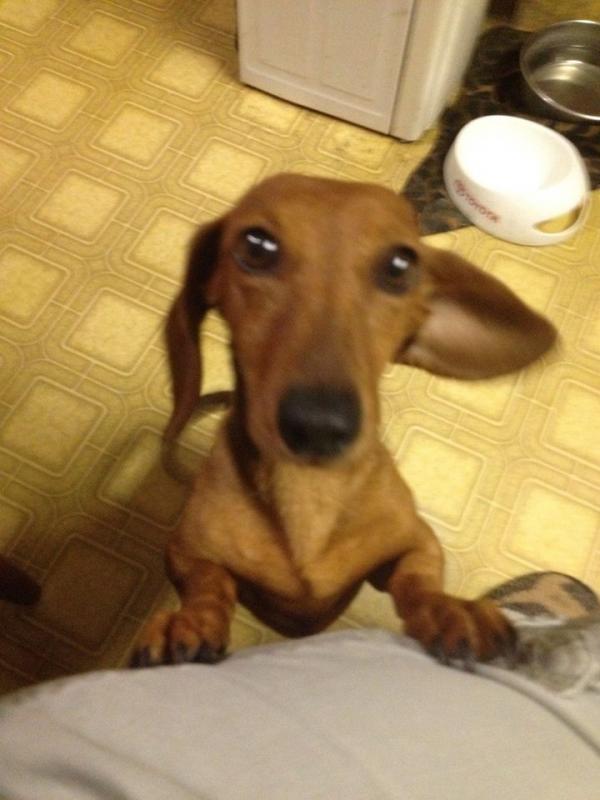
At what (x,y) coordinates should I click in order to perform the action: click on white food dish for dog. Please return your answer as a coordinate pair (x, y). The height and width of the screenshot is (800, 600). Looking at the image, I should click on (534, 182).